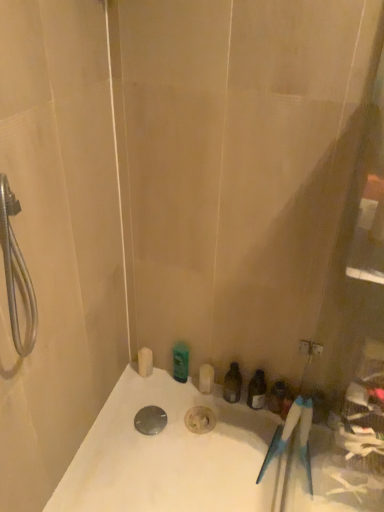
The width and height of the screenshot is (384, 512). In order to click on free space to the left of green matte bottle at upper center, arranged as the 3th toiletry when viewed from the right in this screenshot , I will do `click(142, 392)`.